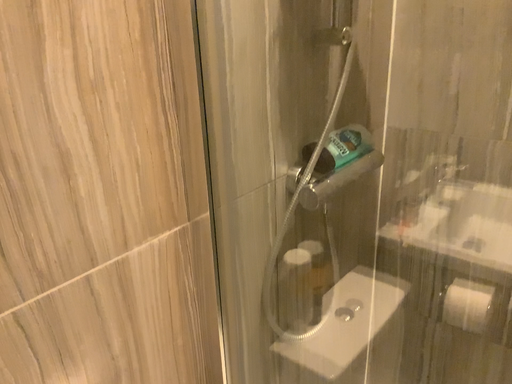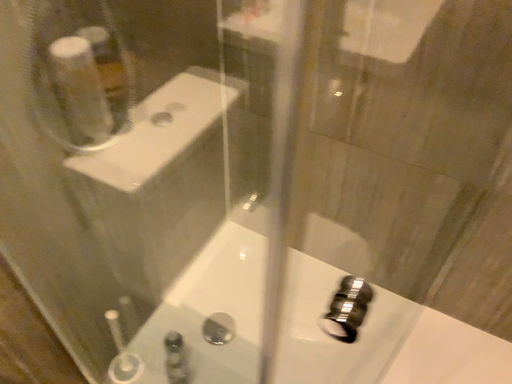
Question: How did the camera likely rotate when shooting the video?

Choices:
 (A) rotated left
 (B) rotated right

Answer: (B)